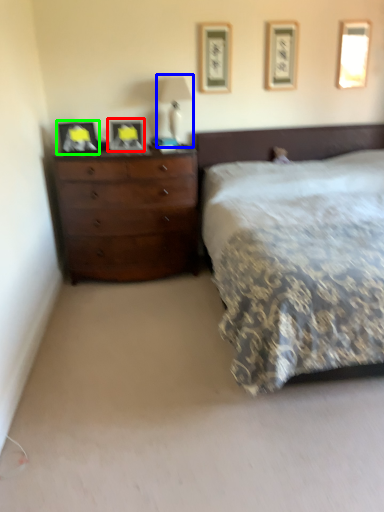
Question: Which object is the farthest from picture frame (highlighted by a red box)? Choose among these: bedside lamp (highlighted by a blue box) or picture frame (highlighted by a green box).

Choices:
 (A) bedside lamp
 (B) picture frame

Answer: (A)